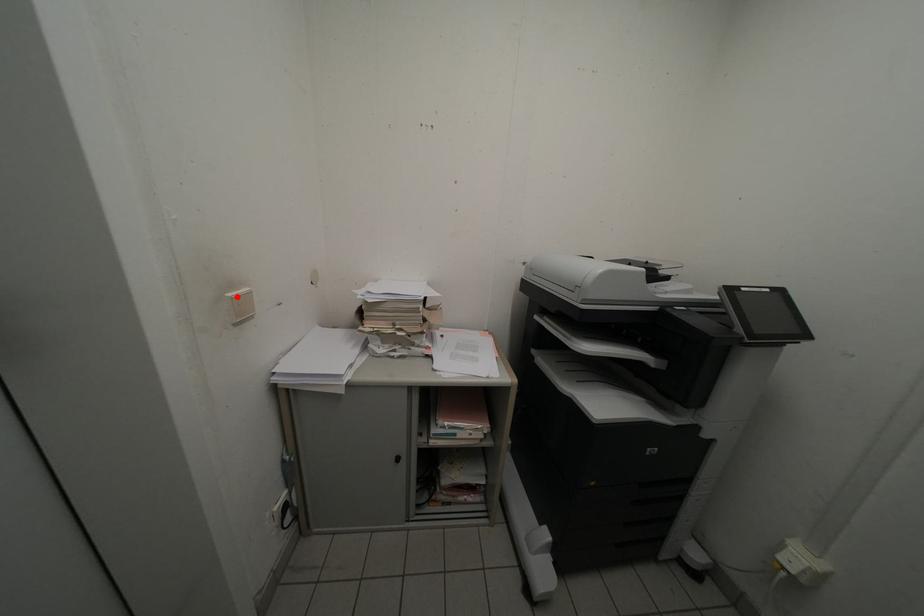
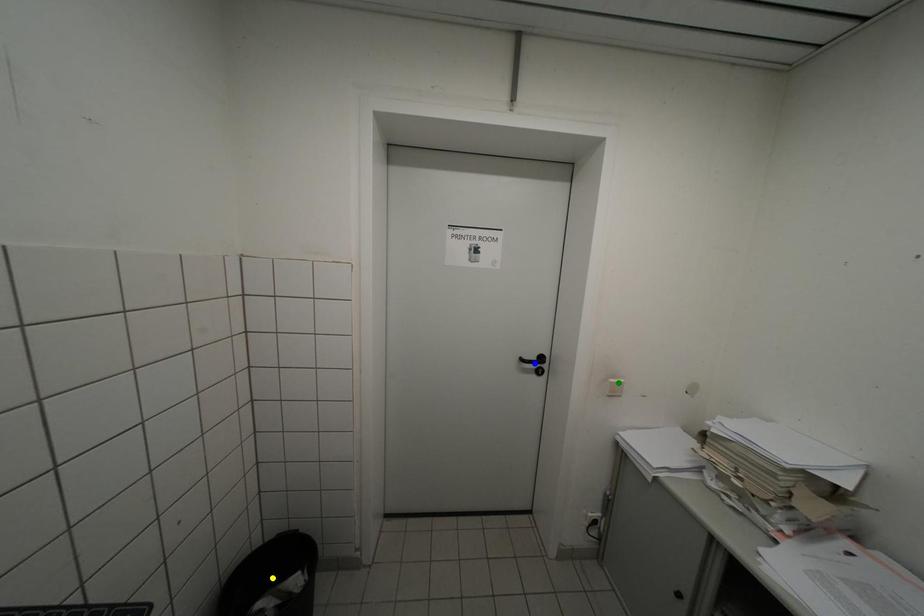
Question: I am providing you with two images of the same scene from different viewpoints. A red point is marked on the first image. You are given multiple points on the second image. In image 2, which mark is for the same physical point as the one in image 1?

Choices:
 (A) blue point
 (B) green point
 (C) yellow point

Answer: (B)